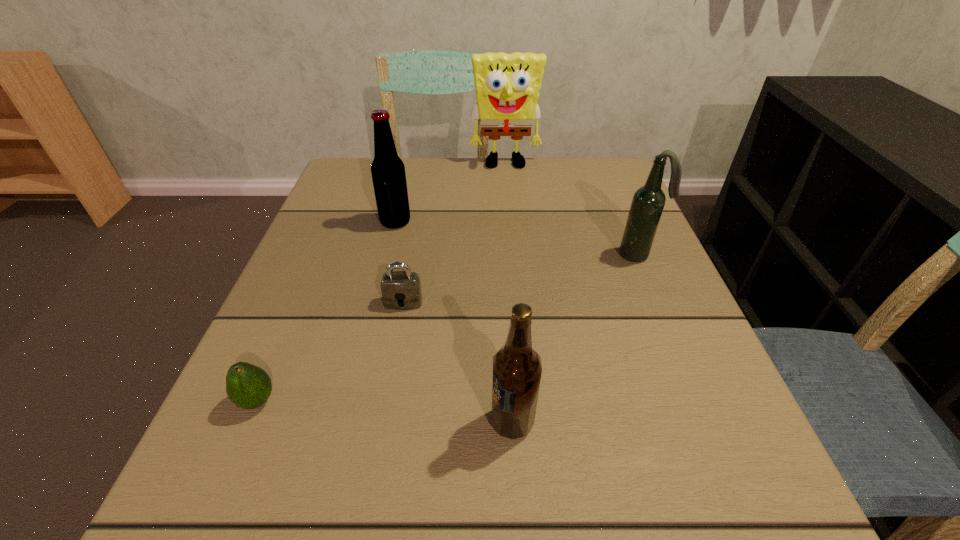
Where is `sponge`? sponge is located at coordinates (507, 86).

The image size is (960, 540). Find the location of `the leftmost beer bottle`. the leftmost beer bottle is located at coordinates (388, 173).

You are a GUI agent. You are given a task and a screenshot of the screen. Output one action in this format:
    pyautogui.click(x=<x>, y=<y>)
    Task: Click on the second farthest object
    
    Given the screenshot: What is the action you would take?
    pyautogui.click(x=388, y=173)

Locate an element on the screen. the third farthest object is located at coordinates (648, 202).

Locate an element on the screen. Image resolution: width=960 pixels, height=540 pixels. the rightmost beer bottle is located at coordinates (648, 202).

You are a GUI agent. You are given a task and a screenshot of the screen. Output one action in this format:
    pyautogui.click(x=<x>, y=<y>)
    Task: Click on the nearest beer bottle
    
    Given the screenshot: What is the action you would take?
    pyautogui.click(x=517, y=368)

You are a GUI agent. You are given a task and a screenshot of the screen. Output one action in this format:
    pyautogui.click(x=<x>, y=<y>)
    Task: Click on the padlock
    
    Given the screenshot: What is the action you would take?
    pyautogui.click(x=401, y=290)

In order to click on avocado in this screenshot , I will do `click(247, 386)`.

The height and width of the screenshot is (540, 960). Identify the location of vacant region located on the face of the sponge. (512, 240).

Image resolution: width=960 pixels, height=540 pixels. I want to click on vacant region located on the back of the fifth nearest object, so click(x=410, y=163).